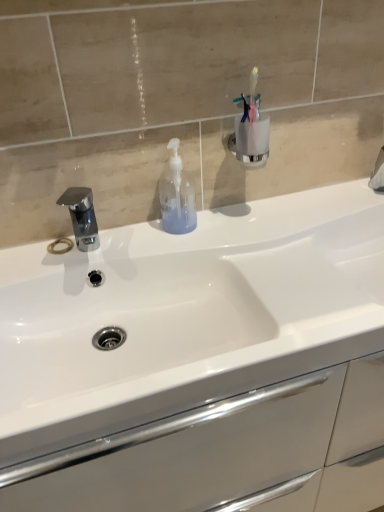
What is the approximate height of chrome metallic faucet at left?

chrome metallic faucet at left is 4.97 inches tall.

Find the location of a particular element. white glossy sink at center is located at coordinates (189, 310).

Where is `tap that is on the left side of translucent plastic soap dispenser at center`? tap that is on the left side of translucent plastic soap dispenser at center is located at coordinates (82, 217).

Considering the relative positions of chrome metallic faucet at left and translucent plastic soap dispenser at center in the image provided, is chrome metallic faucet at left to the left of translucent plastic soap dispenser at center from the viewer's perspective?

Yes, chrome metallic faucet at left is to the left of translucent plastic soap dispenser at center.

Do you think chrome metallic faucet at left is within translucent plastic soap dispenser at center, or outside of it?

chrome metallic faucet at left is located beyond the bounds of translucent plastic soap dispenser at center.

Is translucent plastic soap dispenser at center placed right next to white glossy sink at center?

No.

Based on the photo, from a real-world perspective, is translucent plastic soap dispenser at center above or below white glossy sink at center?

Clearly, from a real-world perspective, translucent plastic soap dispenser at center is above white glossy sink at center.

Is white glossy sink at center at the back of translucent plastic soap dispenser at center?

No, translucent plastic soap dispenser at center is not facing away from white glossy sink at center.

Which is behind, point (170, 230) or point (26, 268)?

The point (170, 230) is behind.

Considering the positions of point (377, 287) and point (183, 179), is point (377, 287) closer or farther from the camera than point (183, 179)?

Point (377, 287) is positioned closer to the camera compared to point (183, 179).

Is white glossy sink at center oriented away from translucent plastic soap dispenser at center?

No, translucent plastic soap dispenser at center is not at the back of white glossy sink at center.

Between white glossy sink at center and translucent plastic soap dispenser at center, which one has larger width?

white glossy sink at center is wider.

Does white glossy sink at center contain translucent plastic soap dispenser at center?

No, translucent plastic soap dispenser at center is not inside white glossy sink at center.

From a real-world perspective, which is physically below, white glossy sink at center or chrome metallic faucet at left?

white glossy sink at center, from a real-world perspective.

Which is in front, point (81, 254) or point (88, 243)?

Point (81, 254)

Which of these two, white glossy sink at center or chrome metallic faucet at left, is smaller?

Smaller between the two is chrome metallic faucet at left.

Which is nearer, (70, 207) or (112, 388)?

Point (70, 207) appears to be farther away from the viewer than point (112, 388).

Is chrome metallic faucet at left oriented away from white glossy sink at center?

No, chrome metallic faucet at left is not facing the opposite direction of white glossy sink at center.

From a real-world perspective, who is located higher, chrome metallic faucet at left or white glossy sink at center?

chrome metallic faucet at left is physically above.

Which object is thinner, chrome metallic faucet at left or white glossy sink at center?

With smaller width is chrome metallic faucet at left.

Which is more to the left, translucent plastic soap dispenser at center or chrome metallic faucet at left?

chrome metallic faucet at left is more to the left.

Considering the sizes of objects translucent plastic soap dispenser at center and chrome metallic faucet at left in the image provided, who is smaller, translucent plastic soap dispenser at center or chrome metallic faucet at left?

Smaller between the two is translucent plastic soap dispenser at center.

Could chrome metallic faucet at left be considered to be inside translucent plastic soap dispenser at center?

No, chrome metallic faucet at left is not inside translucent plastic soap dispenser at center.

From their relative heights in the image, would you say translucent plastic soap dispenser at center is taller or shorter than chrome metallic faucet at left?

translucent plastic soap dispenser at center is taller than chrome metallic faucet at left.

The width and height of the screenshot is (384, 512). I want to click on soap dispenser that appears above the chrome metallic faucet at left (from the image's perspective), so click(x=177, y=195).

Locate an element on the screen. soap dispenser above the white glossy sink at center (from a real-world perspective) is located at coordinates (177, 195).

Estimate the real-world distances between objects in this image. Which object is further from white glossy sink at center, translucent plastic soap dispenser at center or chrome metallic faucet at left?

chrome metallic faucet at left lies further to white glossy sink at center than the other object.

Looking at the image, which one is located further to chrome metallic faucet at left, translucent plastic soap dispenser at center or white glossy sink at center?

Among the two, white glossy sink at center is located further to chrome metallic faucet at left.

Looking at the image, which one is located closer to translucent plastic soap dispenser at center, white glossy sink at center or chrome metallic faucet at left?

Among the two, chrome metallic faucet at left is located nearer to translucent plastic soap dispenser at center.

When comparing their distances from white glossy sink at center, does chrome metallic faucet at left or translucent plastic soap dispenser at center seem further?

chrome metallic faucet at left.

Which object lies further to the anchor point chrome metallic faucet at left, white glossy sink at center or translucent plastic soap dispenser at center?

Based on the image, white glossy sink at center appears to be further to chrome metallic faucet at left.

Consider the image. Which object lies nearer to the anchor point translucent plastic soap dispenser at center, chrome metallic faucet at left or white glossy sink at center?

chrome metallic faucet at left is closer to translucent plastic soap dispenser at center.

Locate an element on the screen. soap dispenser between chrome metallic faucet at left and white glossy sink at center in the horizontal direction is located at coordinates (177, 195).